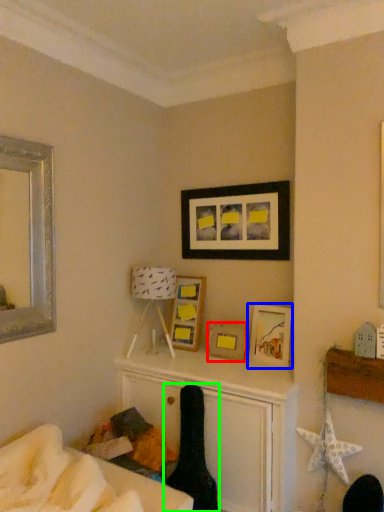
Question: Estimate the real-world distances between objects in this image. Which object is closer to picture frame (highlighted by a red box), picture frame (highlighted by a blue box) or swivel chair (highlighted by a green box)?

Choices:
 (A) picture frame
 (B) swivel chair

Answer: (A)